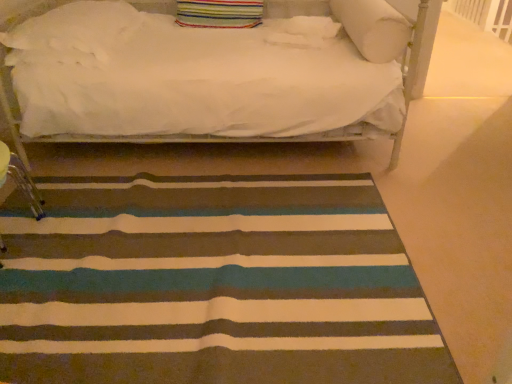
Question: From their relative heights in the image, would you say striped fabric pillow at upper center, which is the 3th pillow in right-to-left order, is taller or shorter than white soft pillow at upper center, the third pillow positioned from the left?

Choices:
 (A) short
 (B) tall

Answer: (B)

Question: Considering the relative positions of striped fabric pillow at upper center, arranged as the second pillow when viewed from the left, and white soft pillow at upper center, the third pillow positioned from the left, in the image provided, is striped fabric pillow at upper center, arranged as the second pillow when viewed from the left, to the left or to the right of white soft pillow at upper center, the third pillow positioned from the left,?

Choices:
 (A) right
 (B) left

Answer: (B)

Question: Which object is the farthest from the striped carpet at center?

Choices:
 (A) white fluffy pillow at upper left, the 1th pillow in the left-to-right sequence
 (B) striped fabric pillow at upper center, which is the 3th pillow in right-to-left order
 (C) white soft pillow at upper right, which ranks as the fourth pillow in left-to-right order
 (D) white soft pillow at upper center, the third pillow positioned from the left

Answer: (B)

Question: Estimate the real-world distances between objects in this image. Which object is closer to the white soft pillow at upper center, the third pillow positioned from the left?

Choices:
 (A) striped fabric pillow at upper center, which is the 3th pillow in right-to-left order
 (B) white soft pillow at upper right, marked as the 1th pillow in a right-to-left arrangement
 (C) white fluffy pillow at upper left, the 1th pillow in the left-to-right sequence
 (D) striped carpet at center

Answer: (B)